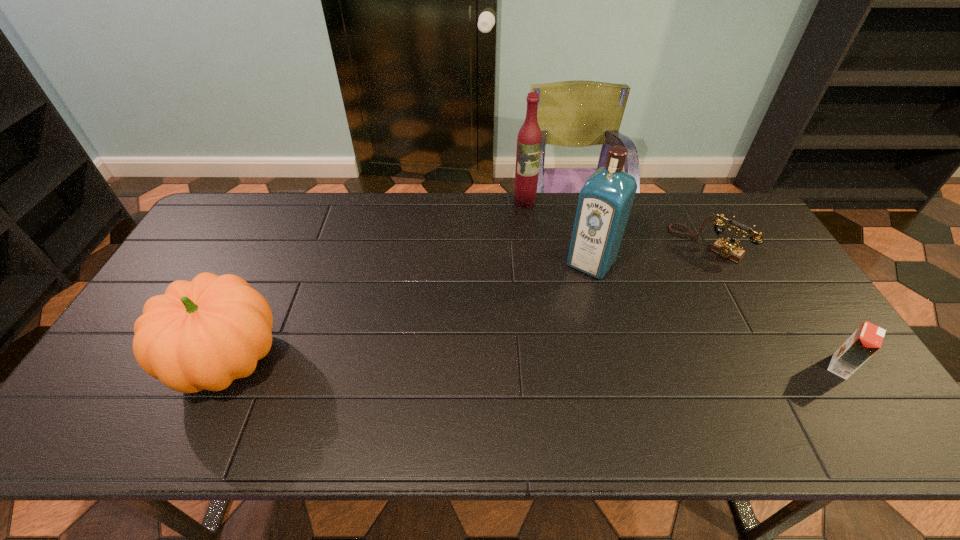
Locate an element on the screen. pumpkin is located at coordinates (202, 334).

The width and height of the screenshot is (960, 540). Find the location of `the leftmost object`. the leftmost object is located at coordinates (202, 334).

Where is `orange juice`? This screenshot has width=960, height=540. orange juice is located at coordinates (867, 339).

At what (x,y) coordinates should I click in order to perform the action: click on the third object from right to left. Please return your answer as a coordinate pair (x, y). The height and width of the screenshot is (540, 960). Looking at the image, I should click on (605, 201).

The height and width of the screenshot is (540, 960). I want to click on the nearer liquor, so click(x=605, y=201).

What are the coordinates of `the farther liquor` in the screenshot? It's located at (529, 141).

The image size is (960, 540). What are the coordinates of `the farthest object` in the screenshot? It's located at (529, 141).

Identify the location of telephone. (729, 249).

You are a GUI agent. You are given a task and a screenshot of the screen. Output one action in this format:
    pyautogui.click(x=<x>, y=<y>)
    Task: Click on the vacant region located 0.100m on the back of the leftmost object
    
    Given the screenshot: What is the action you would take?
    pyautogui.click(x=261, y=290)

Where is `blank space located on the left of the orange juice`? blank space located on the left of the orange juice is located at coordinates (777, 366).